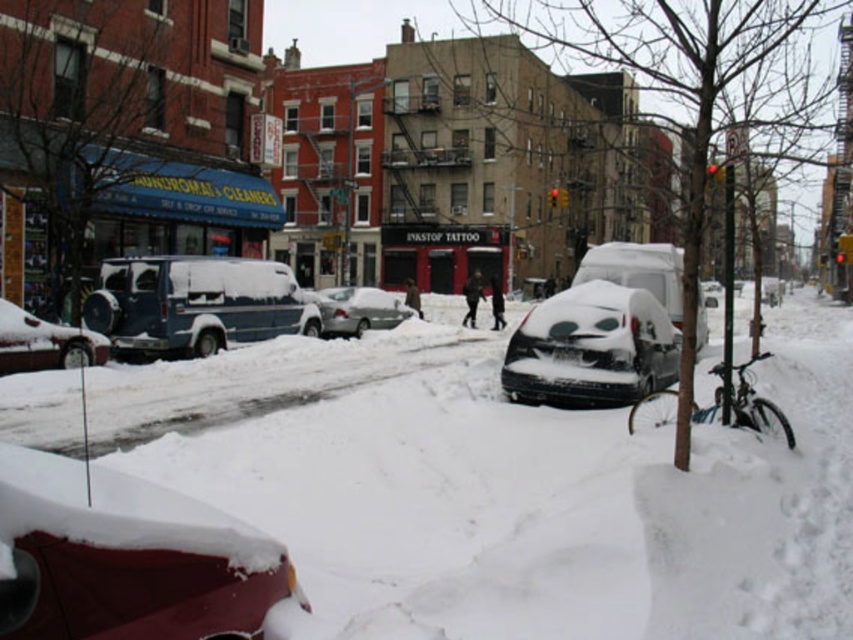
You are standing at the origin point of the image. The white fluffy snow at center is located at coordinates 0.791, 0.644. If you want to reach it, in which direction should you move?

The white fluffy snow at center is located at coordinates (548, 506), so you should move towards the right and down from your current position at the origin to reach it.

You are standing at the center of the snowy street and want to reach a specific point. Which of the two points, point [86,637] or point [364,294], is closer to you?

Point [86,637] is closer to the viewer than point [364,294].

In the snowy urban street scene, you see the white fluffy snow at center and the sleek white van at center. Which object is larger in size?

The sleek white van at center is larger in size than the white fluffy snow at center.